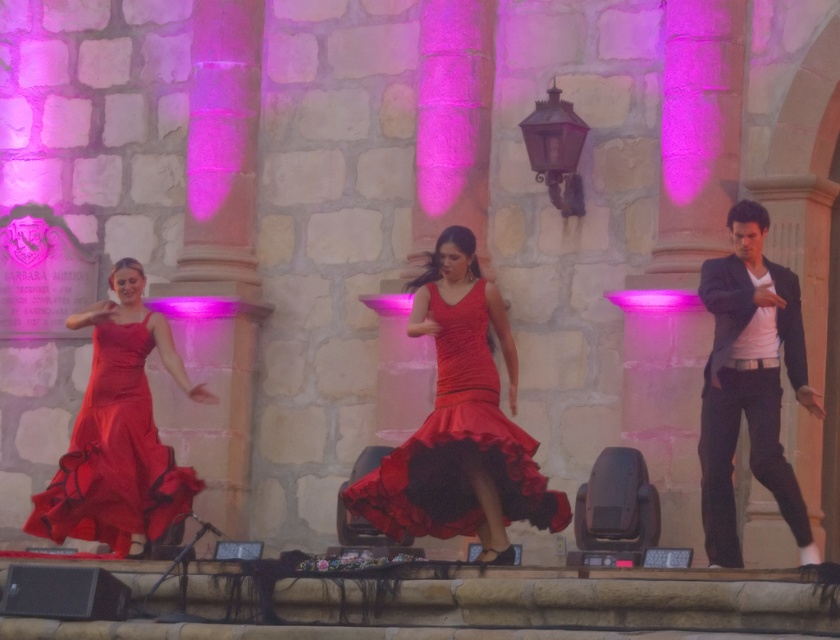
Question: Estimate the real-world distances between objects in this image. Which object is closer to the dark gray suit at right?

Choices:
 (A) satin red dress at left
 (B) satin dress at center

Answer: (B)

Question: Is satin dress at center wider than satin red dress at left?

Choices:
 (A) yes
 (B) no

Answer: (A)

Question: Can you confirm if satin dress at center is positioned below satin red dress at left?

Choices:
 (A) no
 (B) yes

Answer: (A)

Question: Considering the real-world distances, which object is closest to the satin red dress at left?

Choices:
 (A) satin dress at center
 (B) dark gray suit at right

Answer: (A)

Question: Which point is farther to the camera?

Choices:
 (A) (439, 333)
 (B) (775, 483)

Answer: (A)

Question: Is dark gray suit at right thinner than satin red dress at left?

Choices:
 (A) no
 (B) yes

Answer: (A)